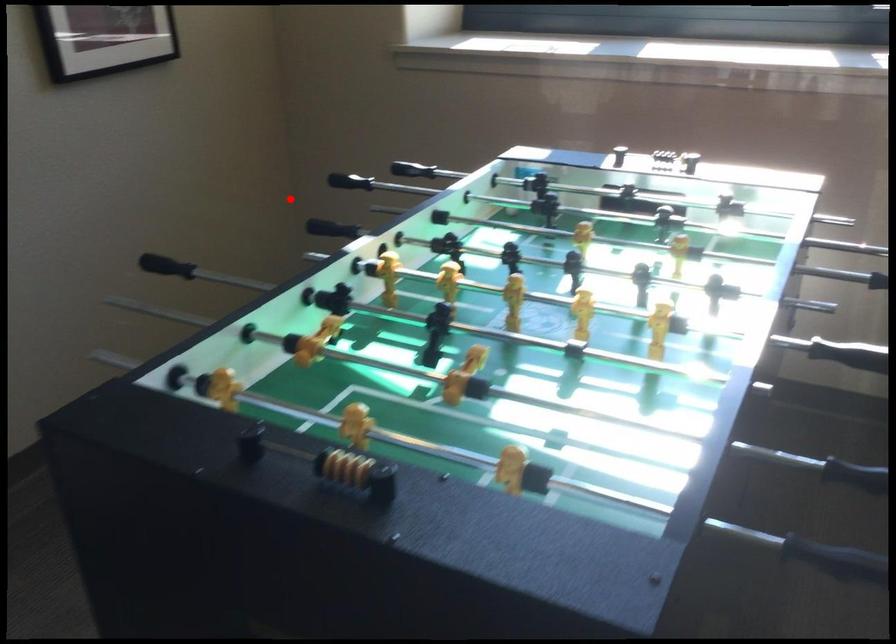
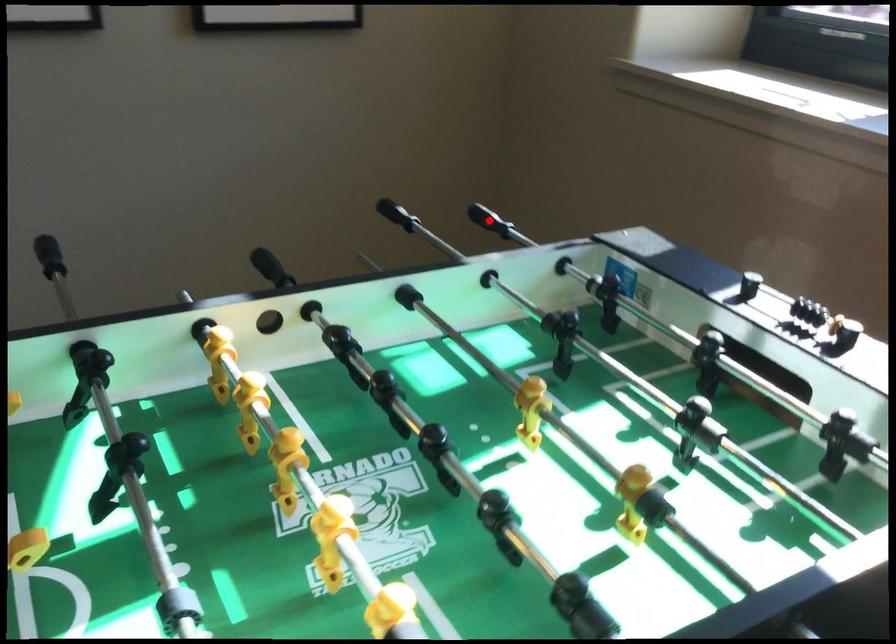
I am providing you with two images of the same scene from different viewpoints. A red point is marked on the first image and another point is marked on the second image. Is the red point in image1 aligned with the point shown in image2?

Yes